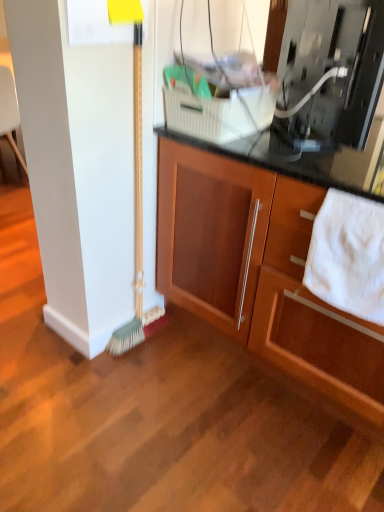
Where is `free space that is in between green bristle broom at left and wooden cabinet at center`? This screenshot has height=512, width=384. free space that is in between green bristle broom at left and wooden cabinet at center is located at coordinates (210, 383).